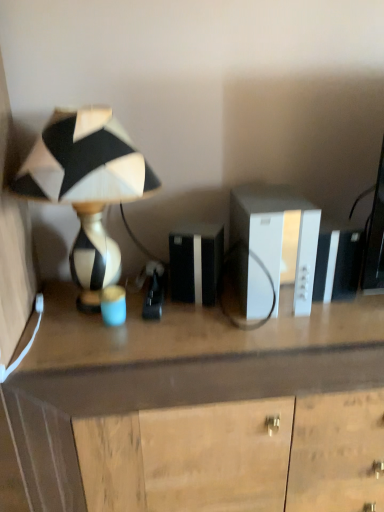
Find the location of a particular element. vacant area that is in front of white plastic cabinet at center is located at coordinates (274, 339).